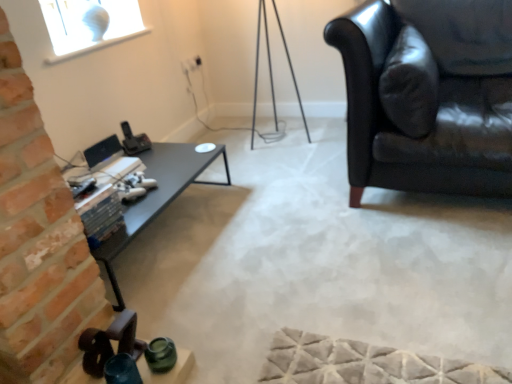
Question: From the image's perspective, is black glossy table at left over black leather couch at right?

Choices:
 (A) no
 (B) yes

Answer: (A)

Question: Are black glossy table at left and black leather couch at right beside each other?

Choices:
 (A) yes
 (B) no

Answer: (B)

Question: Does black glossy table at left have a lesser width compared to black leather couch at right?

Choices:
 (A) no
 (B) yes

Answer: (B)

Question: Can we say black glossy table at left lies outside black leather couch at right?

Choices:
 (A) yes
 (B) no

Answer: (A)

Question: Is there a large distance between black glossy table at left and black leather couch at right?

Choices:
 (A) yes
 (B) no

Answer: (A)

Question: In the image, is satin black monitor at center on the left side or the right side of black glossy table at left?

Choices:
 (A) left
 (B) right

Answer: (A)

Question: From the image's perspective, is satin black monitor at center positioned above or below black glossy table at left?

Choices:
 (A) above
 (B) below

Answer: (A)

Question: Is point (111, 137) closer or farther from the camera than point (208, 163)?

Choices:
 (A) farther
 (B) closer

Answer: (B)

Question: In terms of height, does satin black monitor at center look taller or shorter compared to black glossy table at left?

Choices:
 (A) short
 (B) tall

Answer: (A)

Question: Considering their positions, is satin black monitor at center located in front of or behind black leather couch at right?

Choices:
 (A) behind
 (B) front

Answer: (A)

Question: From a real-world perspective, is satin black monitor at center above or below black leather couch at right?

Choices:
 (A) above
 (B) below

Answer: (B)

Question: Looking at their shapes, would you say satin black monitor at center is wider or thinner than black leather couch at right?

Choices:
 (A) wide
 (B) thin

Answer: (B)

Question: Do you think satin black monitor at center is within black leather couch at right, or outside of it?

Choices:
 (A) outside
 (B) inside

Answer: (A)

Question: Is black glossy table at left spatially inside satin black monitor at center, or outside of it?

Choices:
 (A) inside
 (B) outside

Answer: (B)

Question: In terms of height, does black glossy table at left look taller or shorter compared to satin black monitor at center?

Choices:
 (A) short
 (B) tall

Answer: (B)